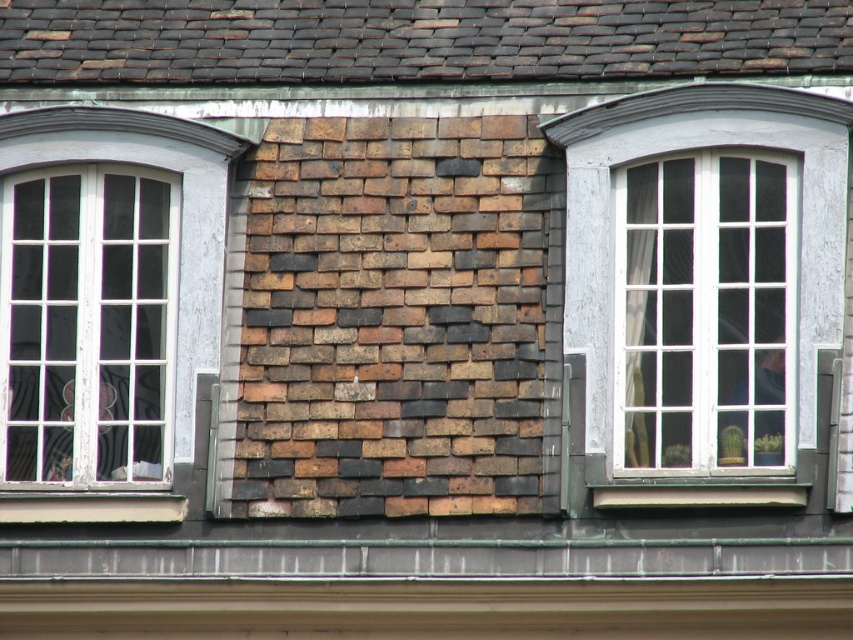
How much distance is there between white wood window at center and white painted wood at lower center?

A distance of 5.42 meters exists between white wood window at center and white painted wood at lower center.

Can you confirm if white wood window at center is shorter than white painted wood at lower center?

In fact, white wood window at center may be taller than white painted wood at lower center.

Where is `white wood window at center`? This screenshot has width=853, height=640. white wood window at center is located at coordinates (691, 148).

Is white wooden window at left further to the viewer compared to white painted wood at lower center?

Yes, white wooden window at left is behind white painted wood at lower center.

Between white wooden window at left and white painted wood at lower center, which one has more height?

With more height is white wooden window at left.

What do you see at coordinates (86, 324) in the screenshot?
I see `white wooden window at left` at bounding box center [86, 324].

You are a GUI agent. You are given a task and a screenshot of the screen. Output one action in this format:
    pyautogui.click(x=<x>, y=<y>)
    Task: Click on the white wooden window at left
    
    Given the screenshot: What is the action you would take?
    pyautogui.click(x=86, y=324)

Does white wooden window at left come behind white wood window at center?

Yes, it is behind white wood window at center.

Is point (22, 209) farther from viewer compared to point (828, 211)?

Yes, point (22, 209) is farther from viewer.

The image size is (853, 640). I want to click on white wooden window at left, so click(x=86, y=324).